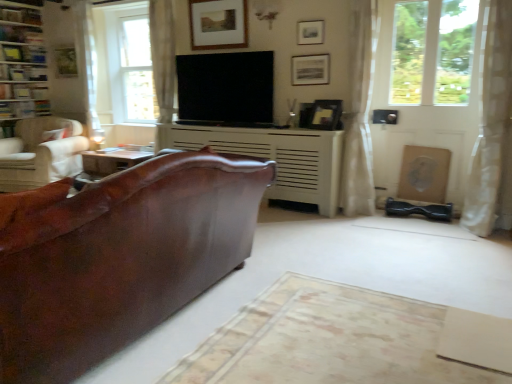
You are a GUI agent. You are given a task and a screenshot of the screen. Output one action in this format:
    pyautogui.click(x=<x>, y=<y>)
    Task: Click on the unoccupied area in front of white sheer curtain at right, which ranks as the first curtain in left-to-right order
    This screenshot has width=512, height=384.
    Given the screenshot: What is the action you would take?
    pyautogui.click(x=368, y=225)